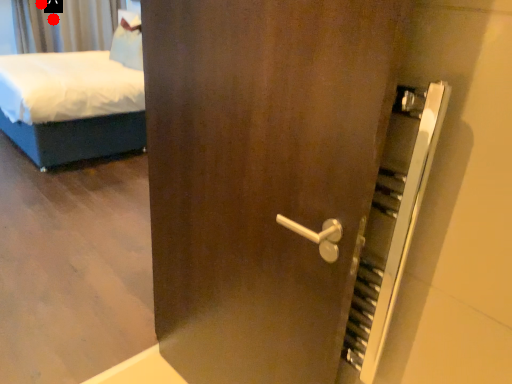
Question: Two points are circled on the image, labeled by A and B beside each circle. Which of the following is the farthest from the observer?

Choices:
 (A) A is further
 (B) B is further

Answer: (A)